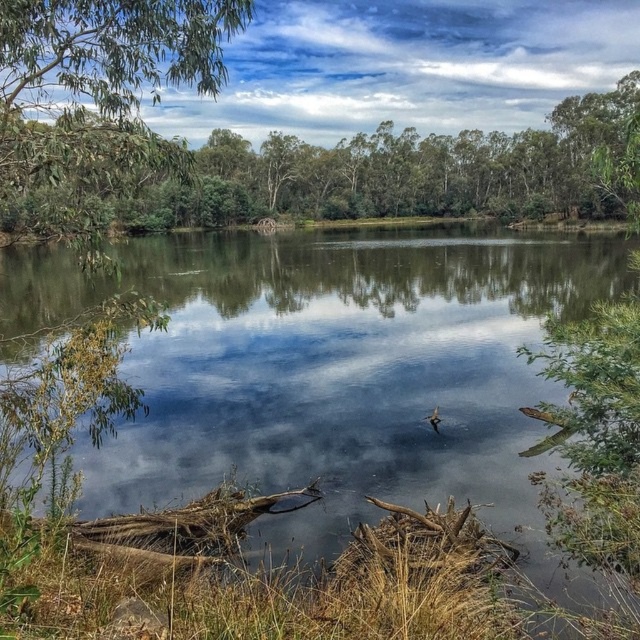
Does clear water at center lie in front of green leafy tree at upper left?

Yes, clear water at center is closer to the viewer.

How distant is clear water at center from green leafy tree at upper left?

clear water at center and green leafy tree at upper left are 45.93 feet apart.

Is point (403, 404) positioned behind point (58, 132)?

Yes, point (403, 404) is behind point (58, 132).

The height and width of the screenshot is (640, 640). I want to click on clear water at center, so click(333, 371).